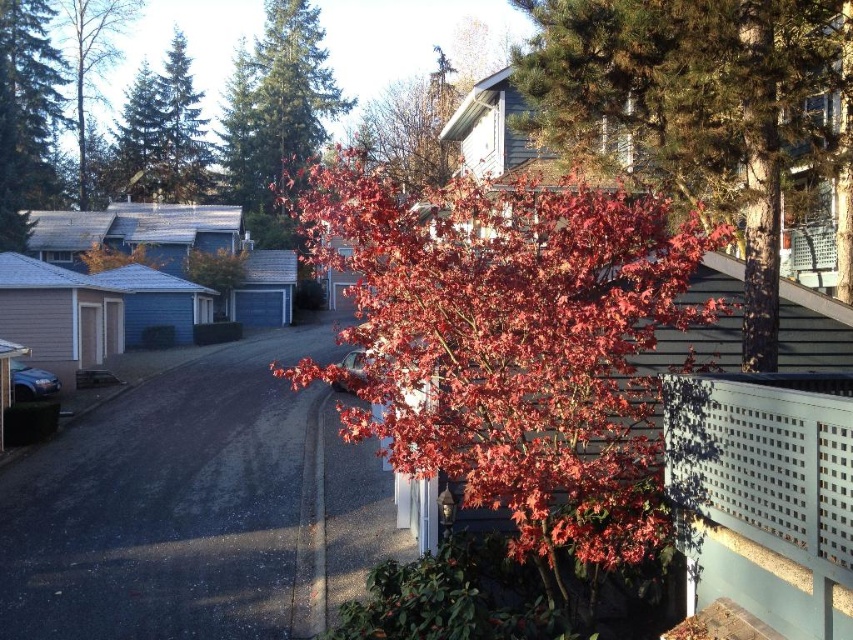
Can you confirm if dark asphalt driveway at lower left is thinner than shiny red leaves at center?

No.

Is the position of dark asphalt driveway at lower left less distant than that of shiny red leaves at center?

Yes, dark asphalt driveway at lower left is in front of shiny red leaves at center.

Does point (294, 580) lie in front of point (558, 4)?

That is True.

This screenshot has width=853, height=640. In order to click on dark asphalt driveway at lower left in this screenshot , I will do `click(196, 508)`.

Which is in front, point (280, 113) or point (44, 10)?

Point (44, 10) is in front.

Is green textured pine tree at upper left wider than shiny green pine tree at upper left?

Indeed, green textured pine tree at upper left has a greater width compared to shiny green pine tree at upper left.

Identify the location of green textured pine tree at upper left. The width and height of the screenshot is (853, 640). (276, 113).

The width and height of the screenshot is (853, 640). Identify the location of green textured pine tree at upper left. pyautogui.click(x=276, y=113).

Does point (614, 104) come in front of point (245, 147)?

Yes, it is.

Who is more forward, (601, 70) or (239, 204)?

Point (601, 70) is more forward.

Between point (680, 19) and point (230, 157), which one is positioned in front?

Positioned in front is point (680, 19).

At what (x,y) coordinates should I click in order to perform the action: click on shiny red leaves at center. Please return your answer as a coordinate pair (x, y). The height and width of the screenshot is (640, 853). Looking at the image, I should click on (692, 106).